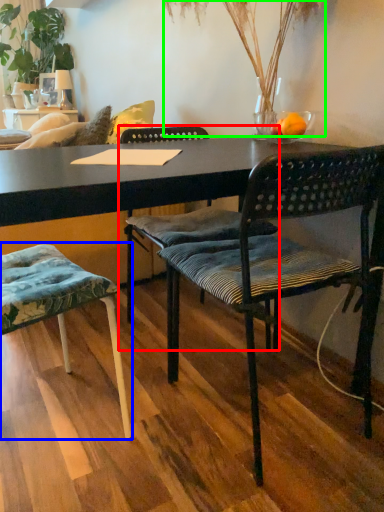
Question: Estimate the real-world distances between objects in this image. Which object is closer to chair (highlighted by a red box), chair (highlighted by a blue box) or plant (highlighted by a green box)?

Choices:
 (A) chair
 (B) plant

Answer: (A)